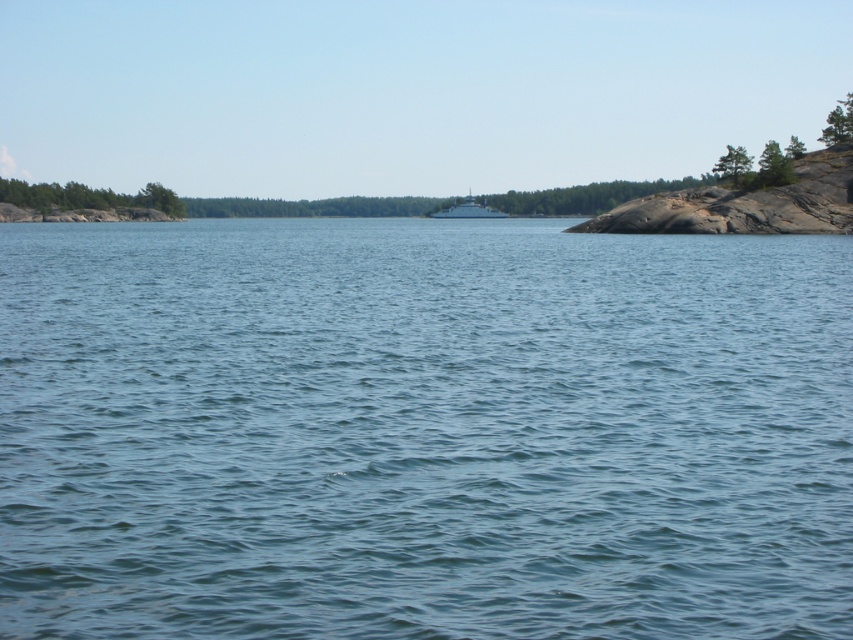
You are standing on the shore of the lake and see the blue water at center and the white glossy boat at center. Which one takes up more space in the image?

The blue water at center takes up more space in the image because it is bigger than the white glossy boat at center.

You are standing on the shore of the lake and see the blue water at center and the white glossy boat at center. Which object is lower in the scene?

The blue water at center is below the white glossy boat at center, so the blue water at center is lower in the scene.

You are a photographer planning to capture the blue water at center and the white glossy boat at center in a single frame. Based on the scene, which object will occupy a larger portion of the photo?

The blue water at center will occupy a larger portion of the photo because its width is larger than that of the white glossy boat at center.